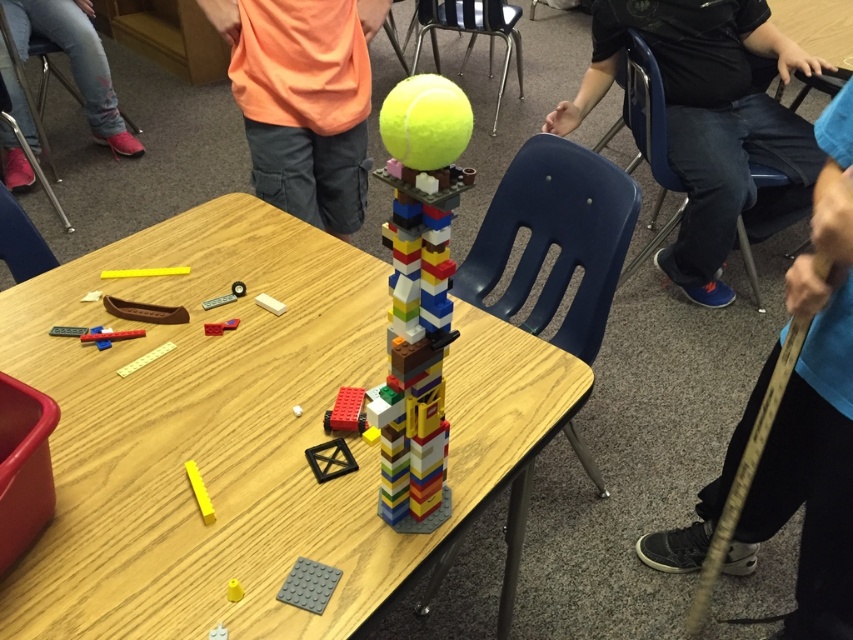
Does wooden table at center appear over blue plastic chair at right?

Actually, wooden table at center is below blue plastic chair at right.

Is wooden table at center positioned behind blue plastic chair at right?

No, wooden table at center is in front of blue plastic chair at right.

Does point (189, 593) lie behind point (636, 100)?

No, it is not.

At what (x,y) coordinates should I click in order to perform the action: click on wooden table at center. Please return your answer as a coordinate pair (x, y). Looking at the image, I should click on pos(248,436).

Between point (90, 102) and point (10, 257), which one is positioned in front?

Positioned in front is point (10, 257).

Between denim jeans at lower left and blue plastic chair at lower left, which one appears on the right side from the viewer's perspective?

blue plastic chair at lower left is more to the right.

What do you see at coordinates (74, 61) in the screenshot? I see `denim jeans at lower left` at bounding box center [74, 61].

Locate an element on the screen. denim jeans at lower left is located at coordinates (x=74, y=61).

Does yellow matte plastic stick at lower left have a larger size compared to yellow plastic block at center?

Correct, yellow matte plastic stick at lower left is larger in size than yellow plastic block at center.

Is point (190, 470) closer to camera compared to point (234, 589)?

No, (190, 470) is further to viewer.

You are a GUI agent. You are given a task and a screenshot of the screen. Output one action in this format:
    pyautogui.click(x=<x>, y=<y>)
    Task: Click on the yellow matte plastic stick at lower left
    The width and height of the screenshot is (853, 640).
    Given the screenshot: What is the action you would take?
    pyautogui.click(x=199, y=492)